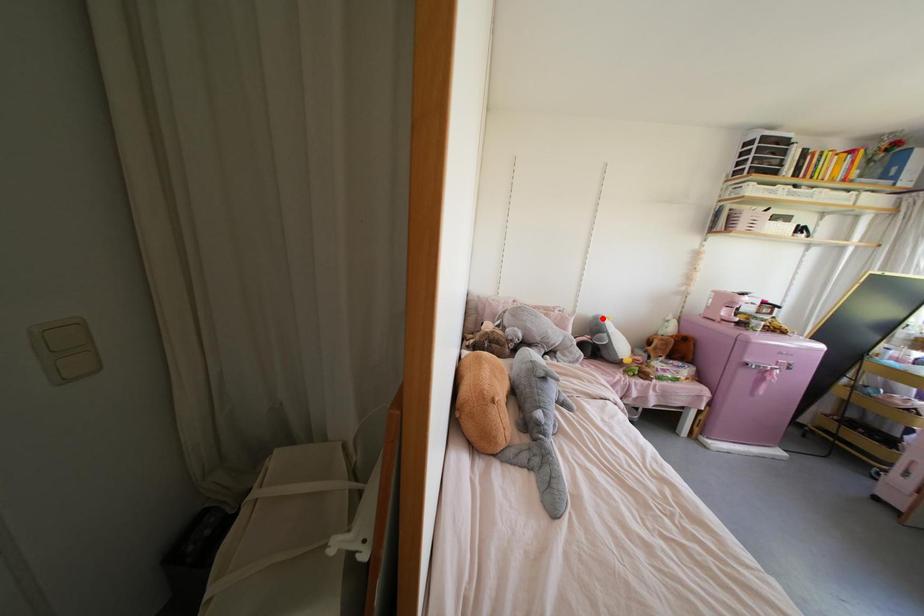
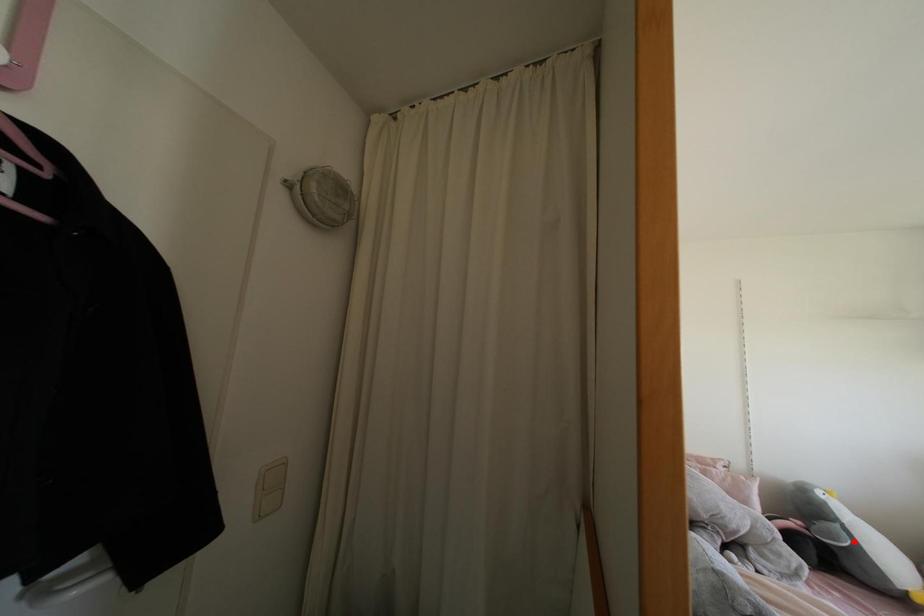
I am providing you with two images of the same scene from different viewpoints. A red point is marked on the first image and another point is marked on the second image. Are the points marked in image1 and image2 representing the same 3D position?

No